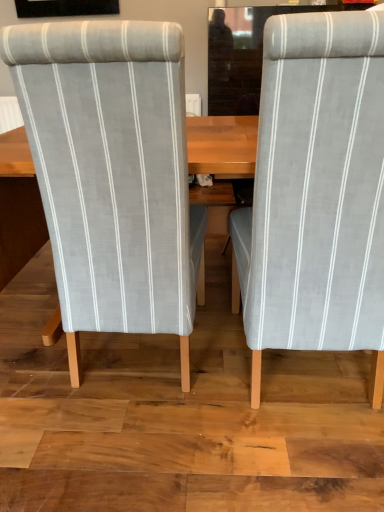
Where is `vacant area situated below gray fabric chair at right, which is the 1th chair in right-to-left order (from a real-world perspective)`? The width and height of the screenshot is (384, 512). vacant area situated below gray fabric chair at right, which is the 1th chair in right-to-left order (from a real-world perspective) is located at coordinates (303, 383).